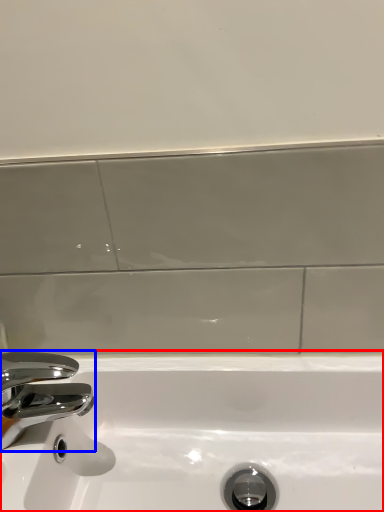
Question: Which of the following is the farthest to the observer, sink (highlighted by a red box) or tap (highlighted by a blue box)?

Choices:
 (A) sink
 (B) tap

Answer: (B)